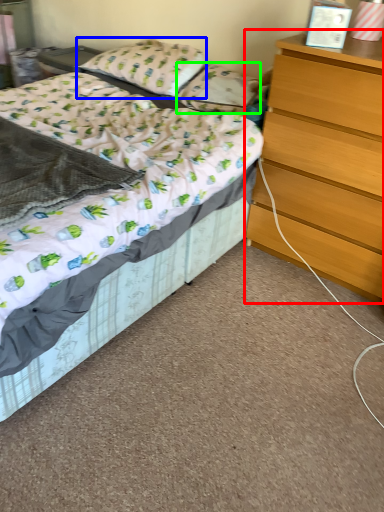
Question: Considering the real-world distances, which object is farthest from chest of drawers (highlighted by a red box)? pillow (highlighted by a blue box) or pillow (highlighted by a green box)?

Choices:
 (A) pillow
 (B) pillow

Answer: (A)